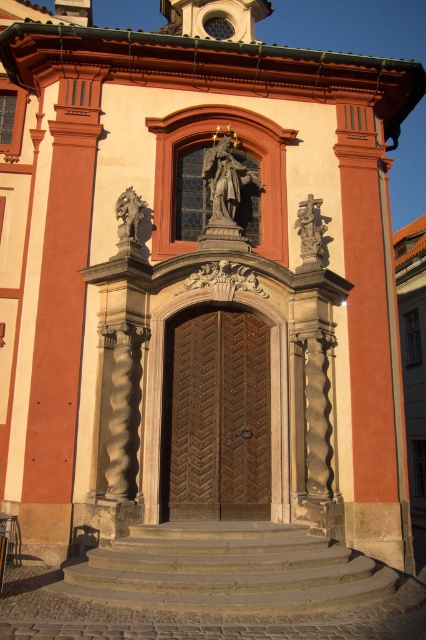
Question: Which point is farther to the camera?

Choices:
 (A) polished stone statue at right
 (B) polished bronze statue at upper center

Answer: (B)

Question: Is wooden door at center above polished bronze statue at upper center?

Choices:
 (A) no
 (B) yes

Answer: (A)

Question: Can you confirm if polished bronze statue at upper center is positioned below polished stone statue at right?

Choices:
 (A) yes
 (B) no

Answer: (B)

Question: Among these objects, which one is nearest to the camera?

Choices:
 (A) polished stone statue at right
 (B) wooden door at center

Answer: (B)

Question: Can you confirm if polished stone statue at right is positioned below matte stone statue at left?

Choices:
 (A) no
 (B) yes

Answer: (B)

Question: Which point is farther from the camera taking this photo?

Choices:
 (A) (313, 256)
 (B) (250, 198)

Answer: (B)